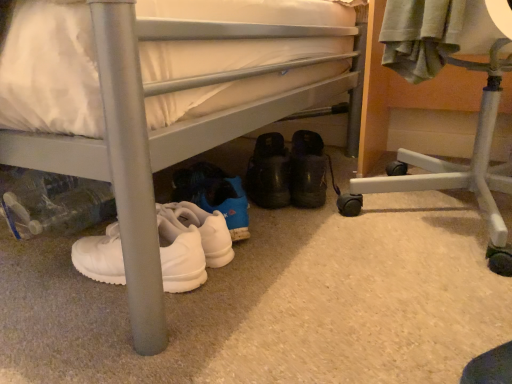
Question: Can you confirm if black suede shoes at center is bigger than white matte sneakers at lower left?

Choices:
 (A) yes
 (B) no

Answer: (B)

Question: Does black suede shoes at center have a smaller size compared to white matte sneakers at lower left?

Choices:
 (A) no
 (B) yes

Answer: (B)

Question: Does black suede shoes at center lie in front of white matte sneakers at lower left?

Choices:
 (A) yes
 (B) no

Answer: (B)

Question: Is black suede shoes at center far away from white matte sneakers at lower left?

Choices:
 (A) yes
 (B) no

Answer: (B)

Question: Can you confirm if black suede shoes at center is thinner than white matte sneakers at lower left?

Choices:
 (A) yes
 (B) no

Answer: (A)

Question: Can you confirm if black suede shoes at center is taller than white matte sneakers at lower left?

Choices:
 (A) yes
 (B) no

Answer: (B)

Question: Is white plastic chair at lower right next to black suede shoes at center and touching it?

Choices:
 (A) yes
 (B) no

Answer: (B)

Question: Is white plastic chair at lower right thinner than black suede shoes at center?

Choices:
 (A) yes
 (B) no

Answer: (B)

Question: From a real-world perspective, is white plastic chair at lower right positioned over black suede shoes at center based on gravity?

Choices:
 (A) yes
 (B) no

Answer: (A)

Question: Is white plastic chair at lower right oriented towards black suede shoes at center?

Choices:
 (A) no
 (B) yes

Answer: (A)

Question: Considering the relative positions of white plastic chair at lower right and black suede shoes at center in the image provided, is white plastic chair at lower right behind black suede shoes at center?

Choices:
 (A) yes
 (B) no

Answer: (B)

Question: Does white plastic chair at lower right have a greater height compared to black suede shoes at center?

Choices:
 (A) no
 (B) yes

Answer: (B)

Question: Can we say white matte sneakers at lower left lies outside white plastic chair at lower right?

Choices:
 (A) yes
 (B) no

Answer: (A)